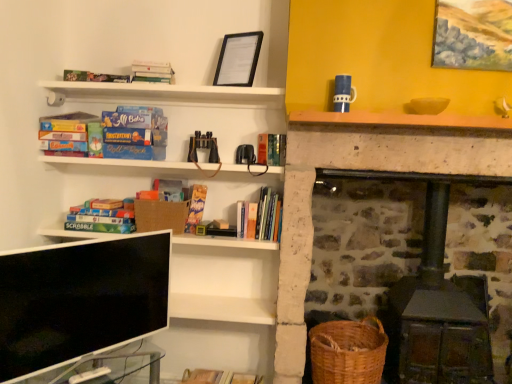
Question: Is matte cardboard board game at left, the third book in the bottom-to-top sequence, looking in the opposite direction of hardcover book at upper left, acting as the third book starting from the right?

Choices:
 (A) no
 (B) yes

Answer: (A)

Question: Is matte cardboard board game at left, arranged as the first book when viewed from the left, at the right side of hardcover book at upper left, the second book viewed from the top?

Choices:
 (A) no
 (B) yes

Answer: (A)

Question: From a real-world perspective, is matte cardboard board game at left, marked as the fifth book in a right-to-left arrangement, physically below hardcover book at upper left, placed as the 3th book when sorted from left to right?

Choices:
 (A) no
 (B) yes

Answer: (B)

Question: Is matte cardboard board game at left, the 3th book positioned from the top, thinner than hardcover book at upper left, which is the 4th book in bottom-to-top order?

Choices:
 (A) no
 (B) yes

Answer: (A)

Question: Can you confirm if matte cardboard board game at left, the 3th book positioned from the top, is shorter than hardcover book at upper left, the second book viewed from the top?

Choices:
 (A) yes
 (B) no

Answer: (B)

Question: Is matte cardboard board game at left, marked as the fifth book in a right-to-left arrangement, to the left or to the right of hardcover book at center, the second book in the bottom-to-top sequence, in the image?

Choices:
 (A) right
 (B) left

Answer: (B)

Question: In terms of width, does matte cardboard board game at left, the 3th book positioned from the top, look wider or thinner when compared to hardcover book at center, which appears as the 4th book when viewed from the top?

Choices:
 (A) thin
 (B) wide

Answer: (B)

Question: Does point (70, 127) appear closer or farther from the camera than point (259, 147)?

Choices:
 (A) farther
 (B) closer

Answer: (B)

Question: Considering the positions of matte cardboard board game at left, arranged as the first book when viewed from the left, and hardcover book at center, which appears as the 4th book when viewed from the top, in the image, is matte cardboard board game at left, arranged as the first book when viewed from the left, bigger or smaller than hardcover book at center, which appears as the 4th book when viewed from the top,?

Choices:
 (A) big
 (B) small

Answer: (A)

Question: Considering the positions of transparent glass table at lower left and matte green board game at left, placed as the fourth book when sorted from right to left, in the image, is transparent glass table at lower left wider or thinner than matte green board game at left, placed as the fourth book when sorted from right to left,?

Choices:
 (A) thin
 (B) wide

Answer: (B)

Question: Considering the positions of point (146, 352) and point (77, 213), is point (146, 352) closer or farther from the camera than point (77, 213)?

Choices:
 (A) closer
 (B) farther

Answer: (B)

Question: Is transparent glass table at lower left taller or shorter than matte green board game at left, positioned as the 1th book in bottom-to-top order?

Choices:
 (A) tall
 (B) short

Answer: (A)

Question: Is transparent glass table at lower left bigger or smaller than matte green board game at left, which is the second book in left-to-right order?

Choices:
 (A) small
 (B) big

Answer: (B)

Question: Based on their sizes in the image, would you say matte cardboard board game at left, arranged as the first book when viewed from the left, is bigger or smaller than oil painting at upper right, acting as the second picture frame starting from the left?

Choices:
 (A) small
 (B) big

Answer: (B)

Question: Considering the positions of matte cardboard board game at left, the 3th book positioned from the top, and oil painting at upper right, which is the 1th picture frame in right-to-left order, in the image, is matte cardboard board game at left, the 3th book positioned from the top, wider or thinner than oil painting at upper right, which is the 1th picture frame in right-to-left order,?

Choices:
 (A) thin
 (B) wide

Answer: (B)